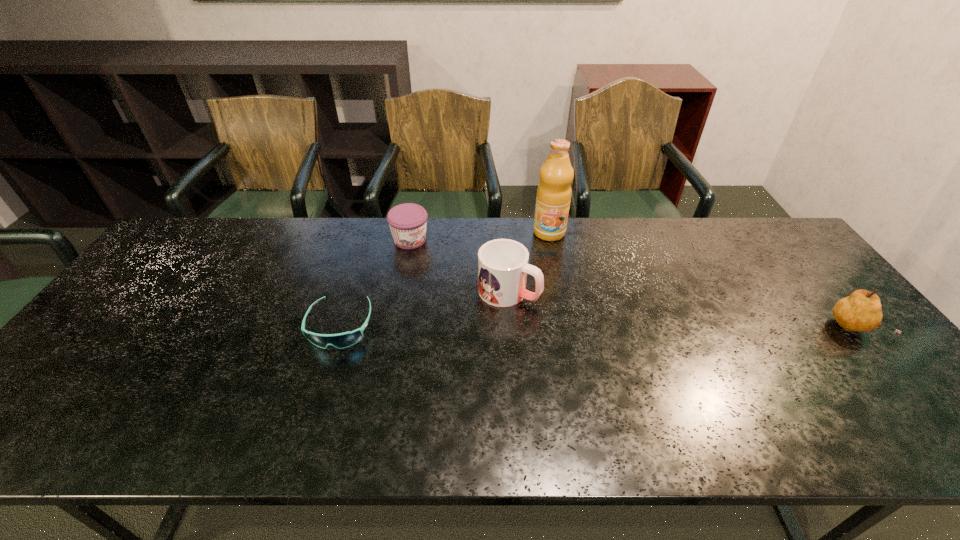
You are a GUI agent. You are given a task and a screenshot of the screen. Output one action in this format:
    pyautogui.click(x=<x>, y=<y>)
    Task: Click on the blank area located 0.120m on the side of the third object from right to left with the handle
    The image size is (960, 540).
    Given the screenshot: What is the action you would take?
    pyautogui.click(x=574, y=321)

I want to click on free location located 0.300m on the front label of the second shortest object, so click(486, 298).

Where is `blank space located on the front label of the second shortest object`? blank space located on the front label of the second shortest object is located at coordinates (489, 299).

Identify the location of vacant area situated 0.100m on the front label of the second shortest object. (442, 264).

This screenshot has width=960, height=540. In order to click on vacant space located on the front label of the fruit juice in this screenshot , I will do `click(543, 327)`.

Find the location of a particular element. This screenshot has width=960, height=540. vacant space situated on the front label of the fruit juice is located at coordinates (546, 281).

At what (x,y) coordinates should I click in order to perform the action: click on vacant space located 0.130m on the front label of the fruit juice. Please return your answer as a coordinate pair (x, y). This screenshot has width=960, height=540. Looking at the image, I should click on (547, 268).

This screenshot has height=540, width=960. What are the coordinates of `jam that is at the far edge` in the screenshot? It's located at (408, 221).

Locate an element on the screen. This screenshot has width=960, height=540. fruit juice positioned at the far edge is located at coordinates (554, 191).

Locate an element on the screen. This screenshot has width=960, height=540. object present at the right edge is located at coordinates 861,311.